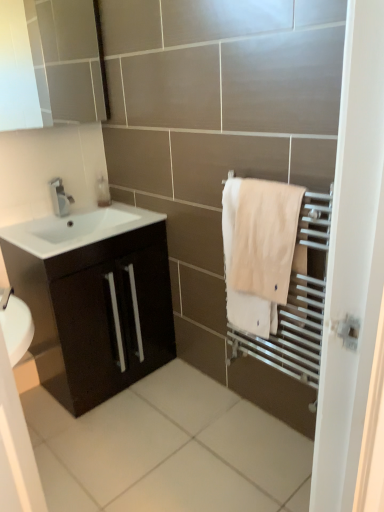
What do you see at coordinates (78, 225) in the screenshot? This screenshot has width=384, height=512. I see `white glossy sink at lower left` at bounding box center [78, 225].

This screenshot has width=384, height=512. What do you see at coordinates (102, 192) in the screenshot?
I see `translucent plastic soap dispenser at upper left` at bounding box center [102, 192].

At what (x,y) coordinates should I click in order to perform the action: click on translucent plastic soap dispenser at upper left. Please return your answer as a coordinate pair (x, y). Looking at the image, I should click on (102, 192).

Describe the element at coordinates (51, 63) in the screenshot. The image size is (384, 512). I see `white glossy medicine cabinet at upper left` at that location.

The image size is (384, 512). Describe the element at coordinates (60, 197) in the screenshot. I see `satin nickel faucet at upper left` at that location.

Image resolution: width=384 pixels, height=512 pixels. What do you see at coordinates (258, 250) in the screenshot? I see `beige cotton towel at right` at bounding box center [258, 250].

Image resolution: width=384 pixels, height=512 pixels. I want to click on white glossy sink at lower left, so click(78, 225).

Can you confirm if satin nickel faucet at upper left is positioned to the left of beige cotton towel at right?

Correct, you'll find satin nickel faucet at upper left to the left of beige cotton towel at right.

Is satin nickel faucet at upper left beside beige cotton towel at right?

No, satin nickel faucet at upper left is not next to beige cotton towel at right.

Can we say satin nickel faucet at upper left lies outside beige cotton towel at right?

Indeed, satin nickel faucet at upper left is completely outside beige cotton towel at right.

Between satin nickel faucet at upper left and beige cotton towel at right, which one has more height?

beige cotton towel at right is taller.

From the picture: Is beige cotton towel at right to the left of matte dark brown cabinet at left from the viewer's perspective?

Incorrect, beige cotton towel at right is not on the left side of matte dark brown cabinet at left.

Is beige cotton towel at right touching matte dark brown cabinet at left?

beige cotton towel at right and matte dark brown cabinet at left are clearly separated.

Looking at this image, from a real-world perspective, which object stands above the other?

beige cotton towel at right.

Does beige cotton towel at right have a lesser height compared to matte dark brown cabinet at left?

Indeed, beige cotton towel at right has a lesser height compared to matte dark brown cabinet at left.

Would you consider matte dark brown cabinet at left to be distant from beige cotton towel at right?

matte dark brown cabinet at left is near beige cotton towel at right, not far away.

Considering the relative positions of matte dark brown cabinet at left and beige cotton towel at right in the image provided, is matte dark brown cabinet at left to the left of beige cotton towel at right from the viewer's perspective?

Correct, you'll find matte dark brown cabinet at left to the left of beige cotton towel at right.

Looking at this image, does matte dark brown cabinet at left have a lesser height compared to beige cotton towel at right?

In fact, matte dark brown cabinet at left may be taller than beige cotton towel at right.

Based on the photo, from a real-world perspective, is matte dark brown cabinet at left located higher than beige cotton towel at right?

No.

In the scene shown: In terms of height, does translucent plastic soap dispenser at upper left look taller or shorter compared to beige cotton towel at right?

Considering their sizes, translucent plastic soap dispenser at upper left has less height than beige cotton towel at right.

From the picture: From the image's perspective, which object appears higher, translucent plastic soap dispenser at upper left or beige cotton towel at right?

translucent plastic soap dispenser at upper left.

Can we say translucent plastic soap dispenser at upper left lies outside beige cotton towel at right?

Yes.

From a real-world perspective, which is physically below, translucent plastic soap dispenser at upper left or beige cotton towel at right?

beige cotton towel at right, from a real-world perspective.

Which is behind, point (57, 194) or point (68, 71)?

The point (68, 71) is farther from the camera.

How much distance is there between satin nickel faucet at upper left and white glossy medicine cabinet at upper left?

They are 23.98 inches apart.

Find the location of `tap lying behind the white glossy medicine cabinet at upper left`. tap lying behind the white glossy medicine cabinet at upper left is located at coordinates (60, 197).

Is satin nickel faucet at upper left in contact with white glossy medicine cabinet at upper left?

No.

In the scene shown: Which point is more forward, (244,252) or (38,225)?

Positioned in front is point (244,252).

Is beige cotton towel at right facing towards white glossy sink at lower left?

No.

In terms of height, does beige cotton towel at right look taller or shorter compared to white glossy sink at lower left?

Clearly, beige cotton towel at right is taller compared to white glossy sink at lower left.

From a real-world perspective, does satin nickel faucet at upper left stand above white glossy sink at lower left?

Correct, in the physical world, satin nickel faucet at upper left is higher than white glossy sink at lower left.

Between point (65, 203) and point (59, 239), which one is positioned behind?

The point (65, 203) is farther.

Does satin nickel faucet at upper left turn towards white glossy sink at lower left?

Yes, satin nickel faucet at upper left is aimed at white glossy sink at lower left.

Between satin nickel faucet at upper left and white glossy sink at lower left, which one has more height?

Standing taller between the two is satin nickel faucet at upper left.

Locate an element on the screen. tap that appears behind the beige cotton towel at right is located at coordinates coord(60,197).

At what (x,y) coordinates should I click in order to perform the action: click on bath towel on the right of the matte dark brown cabinet at left. Please return your answer as a coordinate pair (x, y). The image size is (384, 512). Looking at the image, I should click on (258, 250).

Looking at the image, which one is located further to translucent plastic soap dispenser at upper left, satin nickel faucet at upper left or white glossy sink at lower left?

white glossy sink at lower left.

Consider the image. Considering their positions, is translucent plastic soap dispenser at upper left positioned closer to satin nickel faucet at upper left than white glossy medicine cabinet at upper left?

translucent plastic soap dispenser at upper left is closer to satin nickel faucet at upper left.

Considering their positions, is white glossy medicine cabinet at upper left positioned further to translucent plastic soap dispenser at upper left than matte dark brown cabinet at left?

Based on the image, matte dark brown cabinet at left appears to be further to translucent plastic soap dispenser at upper left.

Based on their spatial positions, is translucent plastic soap dispenser at upper left or matte dark brown cabinet at left closer to beige cotton towel at right?

matte dark brown cabinet at left.

Which object lies nearer to the anchor point beige cotton towel at right, translucent plastic soap dispenser at upper left or white glossy medicine cabinet at upper left?

translucent plastic soap dispenser at upper left is closer to beige cotton towel at right.

When comparing their distances from white glossy sink at lower left, does satin nickel faucet at upper left or translucent plastic soap dispenser at upper left seem further?

translucent plastic soap dispenser at upper left is positioned further to the anchor white glossy sink at lower left.

Looking at the image, which one is located further to translucent plastic soap dispenser at upper left, white glossy sink at lower left or beige cotton towel at right?

The object further to translucent plastic soap dispenser at upper left is beige cotton towel at right.

From the image, which object appears to be nearer to white glossy sink at lower left, beige cotton towel at right or satin nickel faucet at upper left?

The object closer to white glossy sink at lower left is satin nickel faucet at upper left.

This screenshot has width=384, height=512. Identify the location of tap located between white glossy sink at lower left and translucent plastic soap dispenser at upper left in the depth direction. (60, 197).

I want to click on sink between satin nickel faucet at upper left and matte dark brown cabinet at left in the vertical direction, so click(78, 225).

Where is `tap between white glossy medicine cabinet at upper left and white glossy sink at lower left from top to bottom`? The image size is (384, 512). tap between white glossy medicine cabinet at upper left and white glossy sink at lower left from top to bottom is located at coordinates (60, 197).

At what (x,y) coordinates should I click in order to perform the action: click on soap dispenser between white glossy medicine cabinet at upper left and satin nickel faucet at upper left in the vertical direction. Please return your answer as a coordinate pair (x, y). The image size is (384, 512). Looking at the image, I should click on (102, 192).